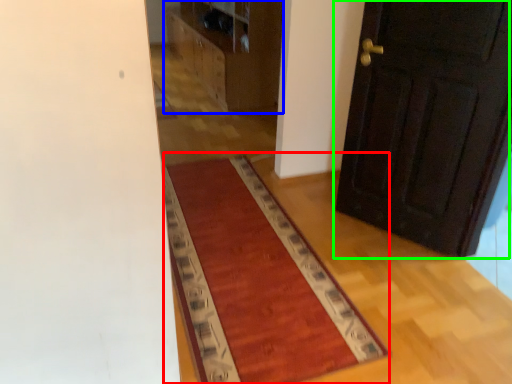
Question: Which object is positioned farthest from mat (highlighted by a red box)? Select from dresser (highlighted by a blue box) and door (highlighted by a green box).

Choices:
 (A) dresser
 (B) door

Answer: (A)